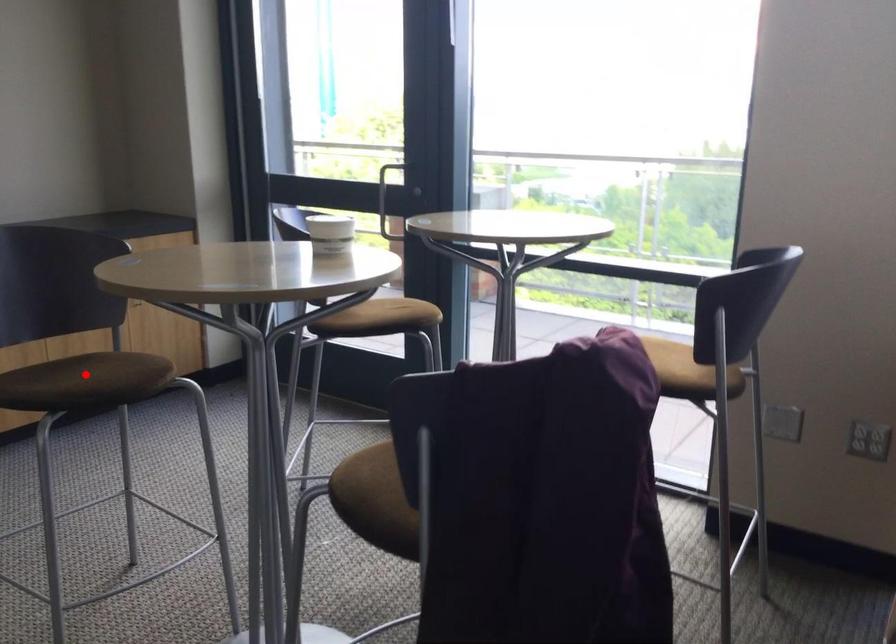
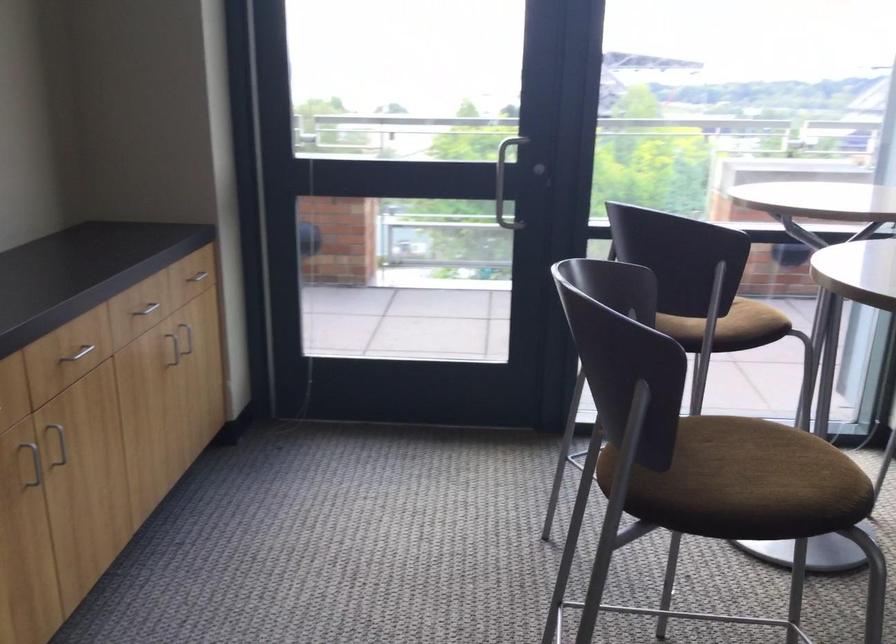
In the second image, find the point that corresponds to the highlighted location in the first image.

(739, 482)